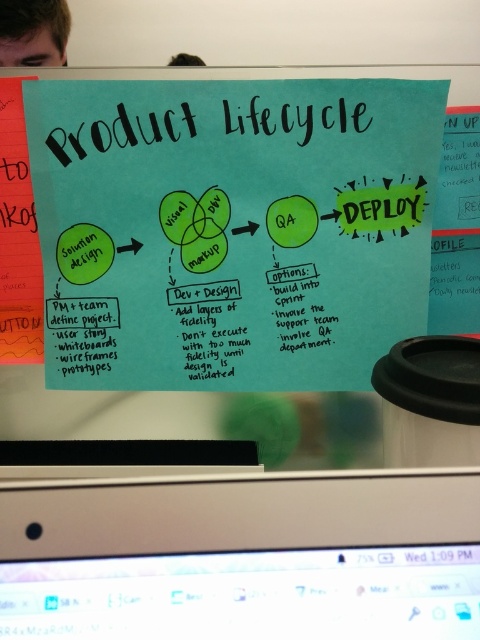
You are an office worker who needs to present both the blue paper poster at center and the black glossy computer monitor at bottom to a client. The client requires that the wider item be placed on the left side for emphasis. Based on the scene, can you determine which item should be placed on the left?

The blue paper poster at center might be wider than black glossy computer monitor at bottom, so it should be placed on the left side to meet the client requirement.

You are sitting at a desk where you can see both the blue paper poster at center and the black glossy computer monitor at bottom. If you want to reach the object that is closer to you, which one should you choose?

The blue paper poster at center is closer to you since it is further to the viewer than the black glossy computer monitor at bottom, meaning it is nearer in your line of sight.